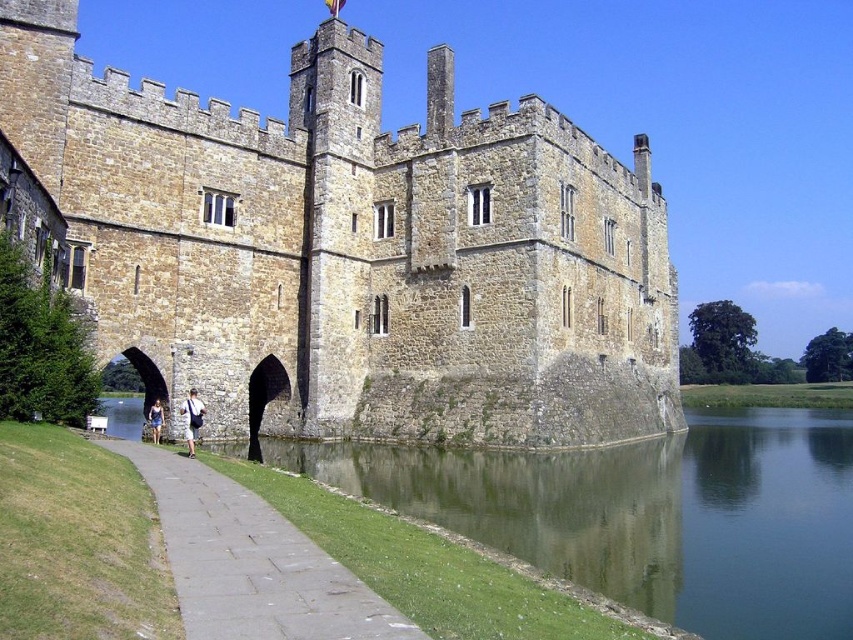
Question: Is green grassy bank at lower left bigger than gray stone path at lower left?

Choices:
 (A) yes
 (B) no

Answer: (A)

Question: Which object appears farthest from the camera in this image?

Choices:
 (A) brown stone castle at center
 (B) green grassy bank at lower left

Answer: (A)

Question: Can you confirm if brown stone castle at center is positioned above gray stone path at lower left?

Choices:
 (A) no
 (B) yes

Answer: (B)

Question: Does green grassy bank at lower left appear on the left side of gray stone path at lower left?

Choices:
 (A) no
 (B) yes

Answer: (A)

Question: Which point appears farthest from the camera in this image?

Choices:
 (A) (666, 444)
 (B) (369, 612)

Answer: (A)

Question: Based on their relative distances, which object is farther from the gray stone path at lower left?

Choices:
 (A) brown stone castle at center
 (B) green grassy bank at lower left

Answer: (A)